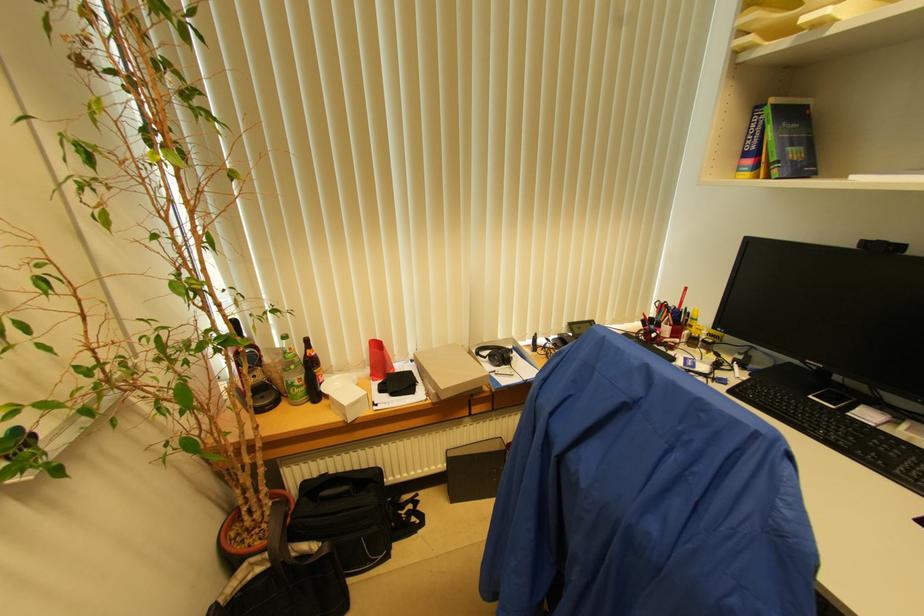
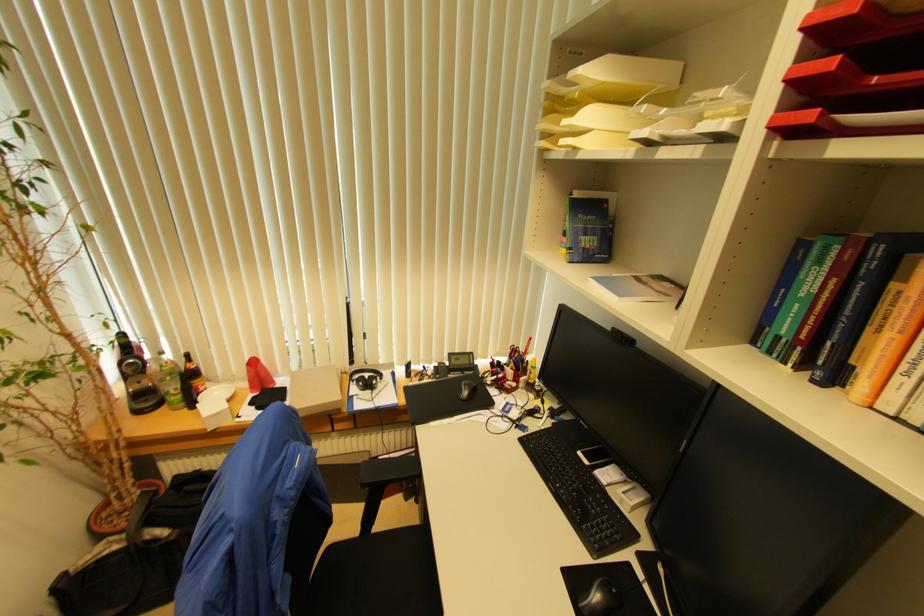
Where in the second image is the point corresponding to point (309, 342) from the first image?

(188, 358)